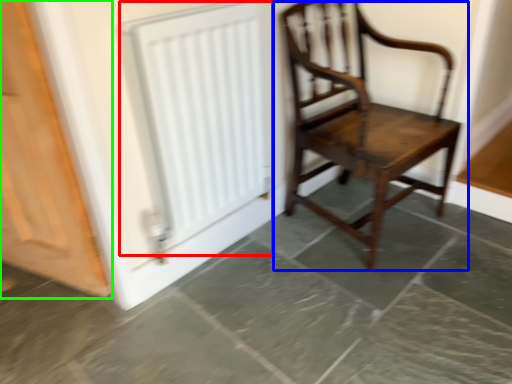
Question: Which object is positioned farthest from radiator (highlighted by a red box)? Select from chair (highlighted by a blue box) and door (highlighted by a green box).

Choices:
 (A) chair
 (B) door

Answer: (A)